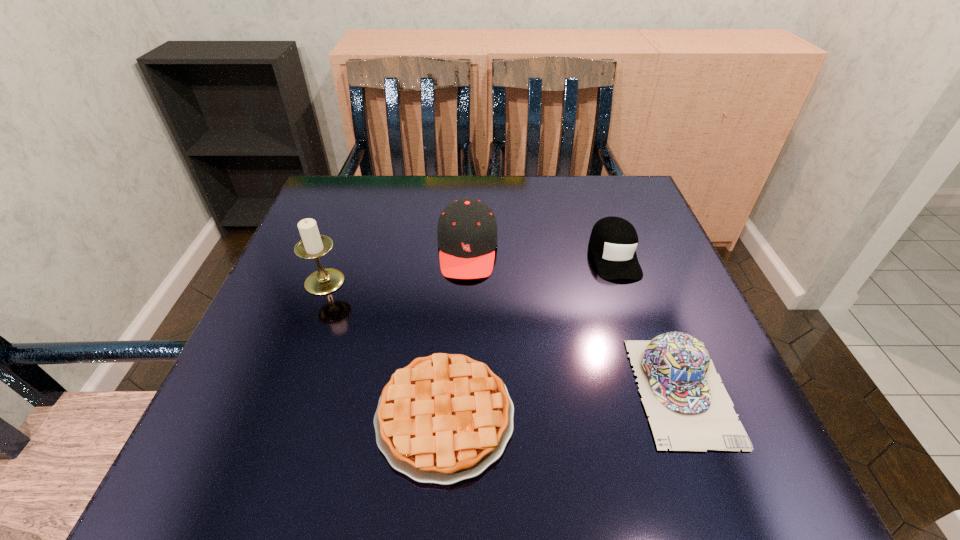
This screenshot has height=540, width=960. Identify the location of candle holder. (313, 245).

This screenshot has width=960, height=540. I want to click on the leftmost object, so point(313,245).

Locate an element on the screen. the leftmost cap is located at coordinates (x=467, y=238).

Where is `the second tallest object`? the second tallest object is located at coordinates (467, 238).

Find the location of `the nearest cap`. the nearest cap is located at coordinates (690, 410).

Where is `the shortest object`? The width and height of the screenshot is (960, 540). the shortest object is located at coordinates (444, 418).

Where is `vacant space located 0.090m on the back of the candle holder`? This screenshot has height=540, width=960. vacant space located 0.090m on the back of the candle holder is located at coordinates (340, 242).

Identify the location of vacant space located 0.300m on the front-facing side of the leftmost cap. (462, 418).

Find the location of a particular element. vacant region located on the right of the pie is located at coordinates (665, 416).

Find the location of `object positioned at the far edge`. object positioned at the far edge is located at coordinates (467, 238).